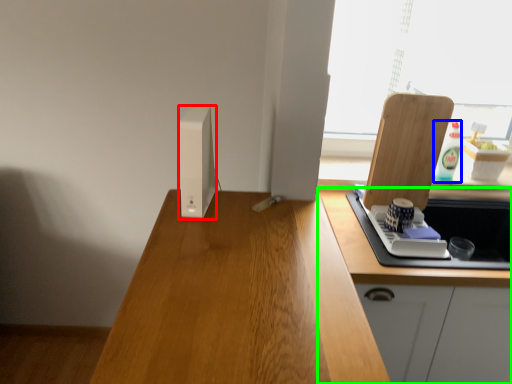
Question: Considering the real-world distances, which object is closest to appliance (highlighted by a red box)? bottle (highlighted by a blue box) or cabinetry (highlighted by a green box).

Choices:
 (A) bottle
 (B) cabinetry

Answer: (B)